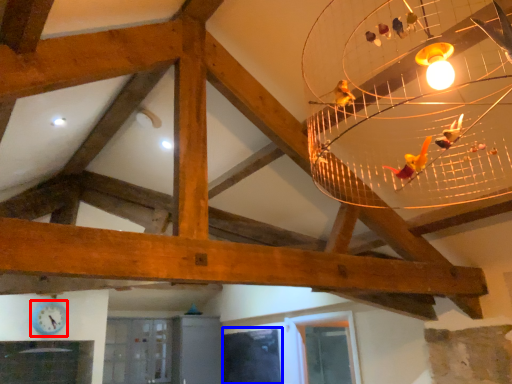
Question: Among these objects, which one is farthest to the camera, clock (highlighted by a red box) or window (highlighted by a blue box)?

Choices:
 (A) clock
 (B) window

Answer: (B)